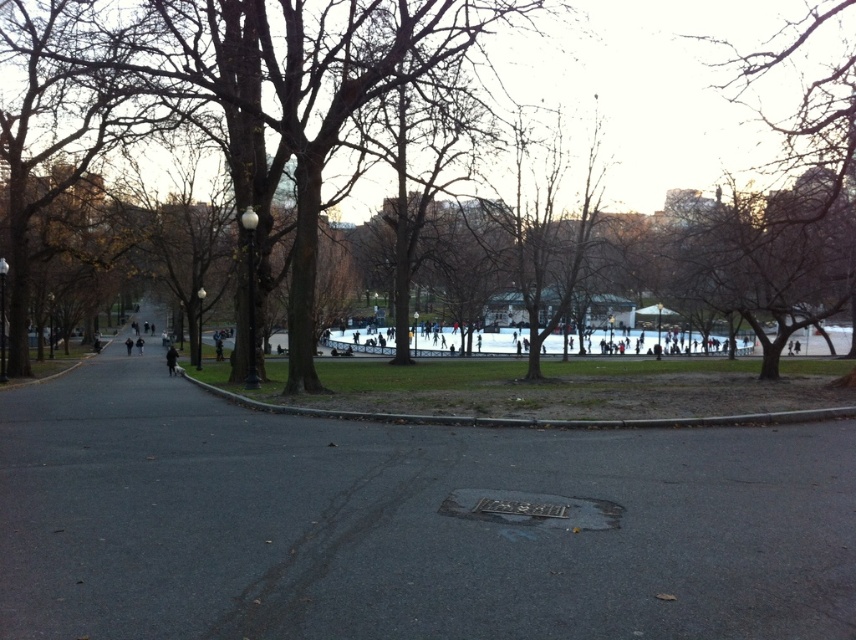
Does dark asphalt pavement at center lie behind black coat at center?

No, dark asphalt pavement at center is closer to the viewer.

Who is more forward, (22, 536) or (171, 374)?

Point (22, 536) is in front.

What do you see at coordinates (403, 524) in the screenshot? The height and width of the screenshot is (640, 856). I see `dark asphalt pavement at center` at bounding box center [403, 524].

At what (x,y) coordinates should I click in order to perform the action: click on dark asphalt pavement at center. Please return your answer as a coordinate pair (x, y). Image resolution: width=856 pixels, height=640 pixels. Looking at the image, I should click on (403, 524).

The height and width of the screenshot is (640, 856). Describe the element at coordinates (403, 524) in the screenshot. I see `dark asphalt pavement at center` at that location.

Can you confirm if dark asphalt pavement at center is positioned to the left of brown bark tree at center?

Incorrect, dark asphalt pavement at center is not on the left side of brown bark tree at center.

Locate an element on the screen. Image resolution: width=856 pixels, height=640 pixels. dark asphalt pavement at center is located at coordinates click(403, 524).

Where is `dark asphalt pavement at center`? The image size is (856, 640). dark asphalt pavement at center is located at coordinates (403, 524).

Does brown bark tree at center have a smaller size compared to black coat at center?

Incorrect, brown bark tree at center is not smaller in size than black coat at center.

Can you confirm if brown bark tree at center is thinner than black coat at center?

→ In fact, brown bark tree at center might be wider than black coat at center.

Identify the location of brown bark tree at center. This screenshot has height=640, width=856. (274, 76).

The height and width of the screenshot is (640, 856). Find the location of `brown bark tree at center`. brown bark tree at center is located at coordinates (274, 76).